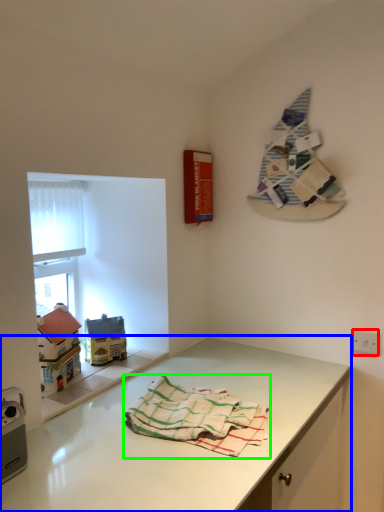
Question: Which object is the farthest from electric outlet (highlighted by a red box)? Choose among these: countertop (highlighted by a blue box) or towel (highlighted by a green box).

Choices:
 (A) countertop
 (B) towel

Answer: (B)